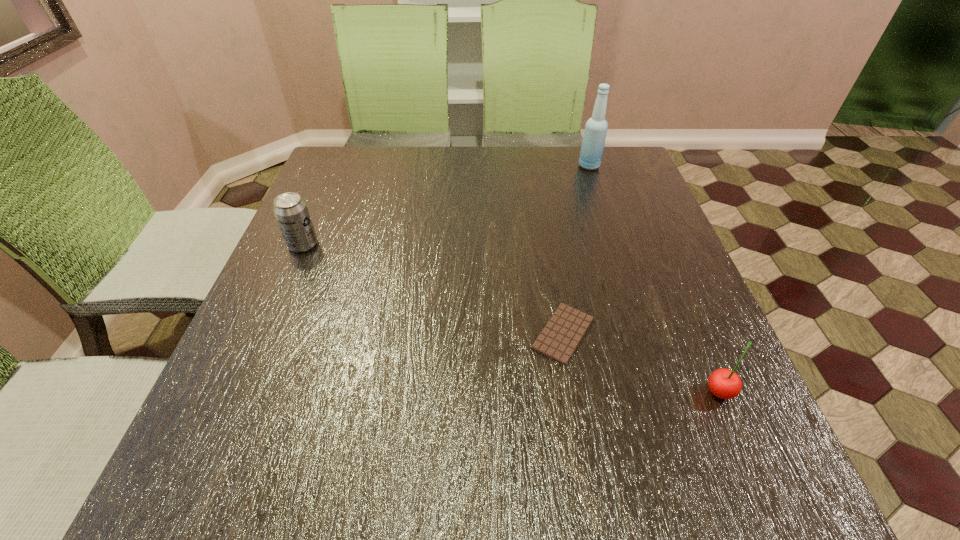
Find the location of a particular element. bottle is located at coordinates (596, 127).

Locate an element on the screen. Image resolution: width=960 pixels, height=540 pixels. the farthest object is located at coordinates (596, 127).

Locate an element on the screen. Image resolution: width=960 pixels, height=540 pixels. the third shortest object is located at coordinates coord(291,212).

You are a GUI agent. You are given a task and a screenshot of the screen. Output one action in this format:
    pyautogui.click(x=<x>, y=<y>)
    Task: Click on the beer can
    
    Given the screenshot: What is the action you would take?
    pyautogui.click(x=291, y=212)

Where is `cherry`? The image size is (960, 540). cherry is located at coordinates (723, 383).

Locate an element on the screen. the second shortest object is located at coordinates (723, 383).

This screenshot has width=960, height=540. Identify the location of the second object from left to right. (559, 339).

Identify the location of the third farthest object. (559, 339).

Locate an element on the screen. This screenshot has height=540, width=960. vacant space located 0.050m on the front of the tallest object is located at coordinates (594, 181).

Where is `vacant space located 0.180m on the right of the leftmost object`? The height and width of the screenshot is (540, 960). vacant space located 0.180m on the right of the leftmost object is located at coordinates (396, 245).